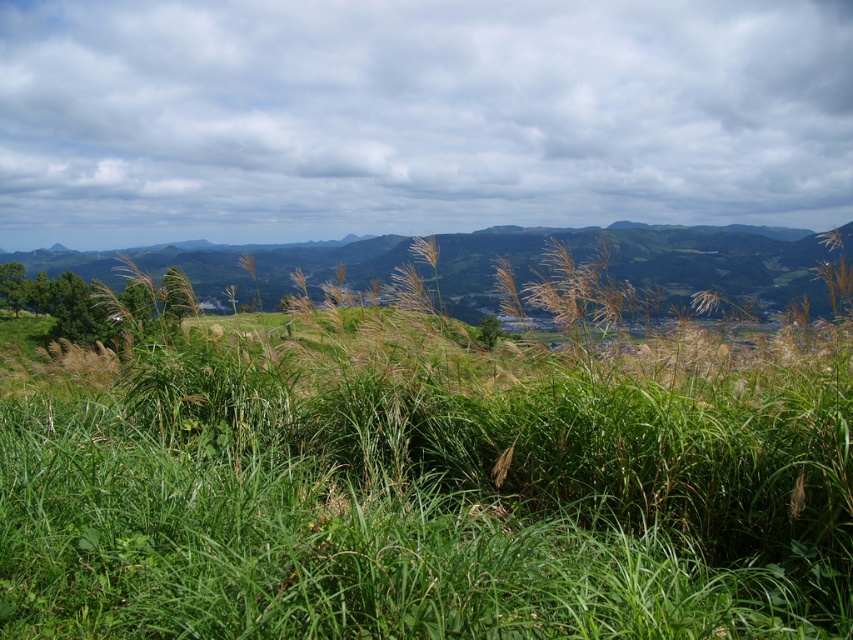
You are standing at the point marked as point (427, 486) in the image. What is the name of the object you are standing on?

The point (427, 486) is where the green grassy at center is located, so you are standing on the green grassy at center.

Based on the scene description, where is the green grassy at center located in terms of coordinates?

The green grassy at center is located at coordinates point (427,486).